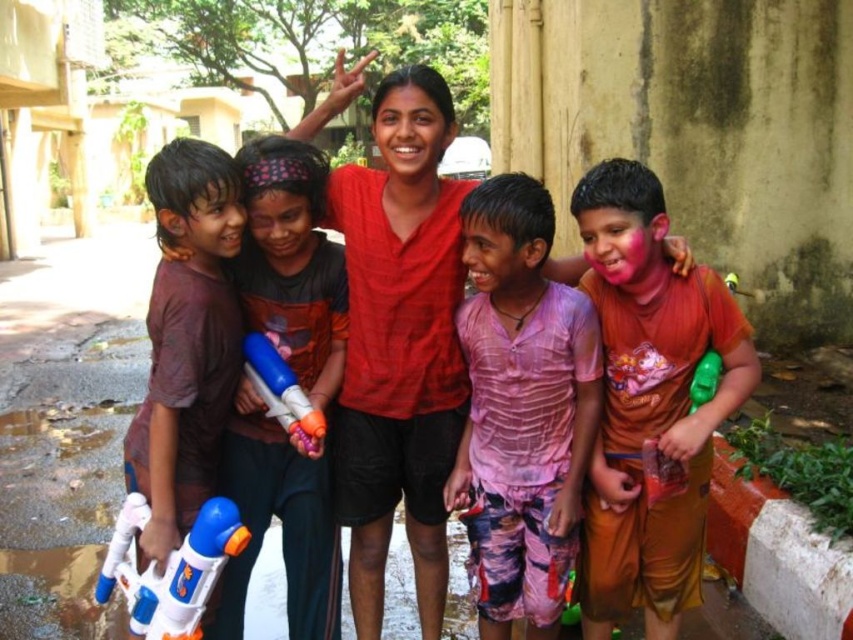
You are a photographer trying to focus on two points in the image. The first point is at coordinates point (x=236, y=216) and the second is at point (x=286, y=365). Which point should you focus on first if you want to start with the closest one?

You should focus on point (x=236, y=216) first because it is closer to the camera than point (x=286, y=365).

You are a photographer trying to capture a clear shot of both the brown matte water gun at left and the white plastic water gun at lower left. Which one should you focus on first to ensure it appears sharp in the photo?

The brown matte water gun at left is above the white plastic water gun at lower left. Since the camera focus is typically sharper in the center, you should focus on the white plastic water gun at lower left first as it is closer to the lower part of the frame.